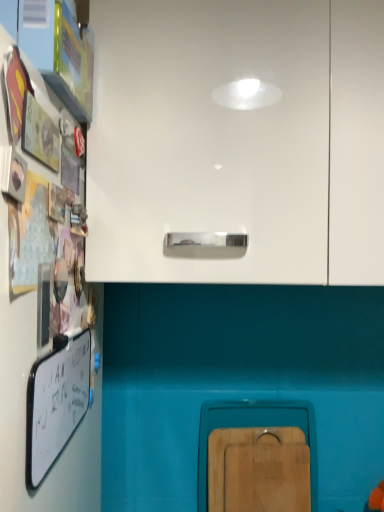
Question: Considering the positions of white glossy cabinet at upper center, arranged as the first cabinetry when viewed from the front, and whiteboard at left in the image, is white glossy cabinet at upper center, arranged as the first cabinetry when viewed from the front, taller or shorter than whiteboard at left?

Choices:
 (A) tall
 (B) short

Answer: (A)

Question: From the image's perspective, is white glossy cabinet at upper center, which is counted as the second cabinetry, starting from the back, located above or below whiteboard at left?

Choices:
 (A) above
 (B) below

Answer: (A)

Question: Which is farther from the whiteboard at left?

Choices:
 (A) wooden cutting board at lower center, arranged as the 2th cabinetry when viewed from the top
 (B) white glossy cabinet at upper center, acting as the 1th cabinetry starting from the top

Answer: (B)

Question: Which of these objects is positioned farthest from the white glossy cabinet at upper center, marked as the 2th cabinetry in a bottom-to-top arrangement?

Choices:
 (A) wooden cutting board at lower center, placed as the 1th cabinetry when sorted from back to front
 (B) whiteboard at left

Answer: (A)